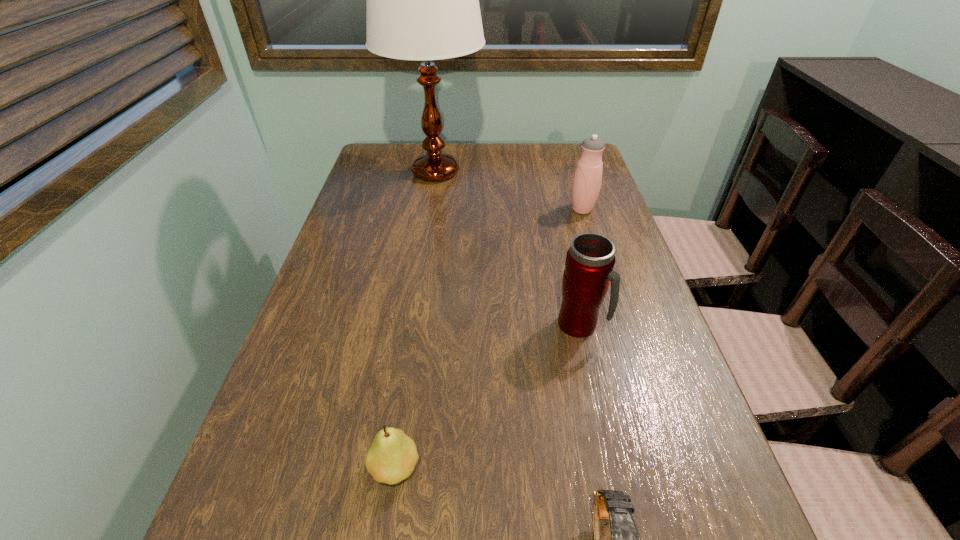
Where is `blank region between the fourth nearest object and the farthest object`? The width and height of the screenshot is (960, 540). blank region between the fourth nearest object and the farthest object is located at coordinates (509, 191).

What are the coordinates of `object identified as the second closest to the farthest object` in the screenshot? It's located at (590, 260).

I want to click on object that is the second closest to the pear, so click(590, 260).